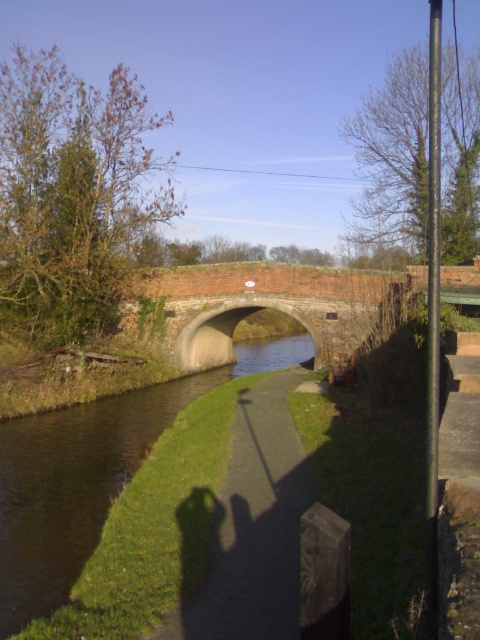
Question: Is dark green water at center thinner than concrete bridge at center?

Choices:
 (A) yes
 (B) no

Answer: (A)

Question: Among these points, which one is nearest to the camera?

Choices:
 (A) (51, 605)
 (B) (202, 364)

Answer: (A)

Question: Which point appears closest to the camera in this image?

Choices:
 (A) (96, 538)
 (B) (291, 278)

Answer: (A)

Question: From the image, what is the correct spatial relationship of dark green water at center in relation to concrete bridge at center?

Choices:
 (A) below
 (B) above

Answer: (A)

Question: Can you confirm if dark green water at center is smaller than concrete bridge at center?

Choices:
 (A) yes
 (B) no

Answer: (A)